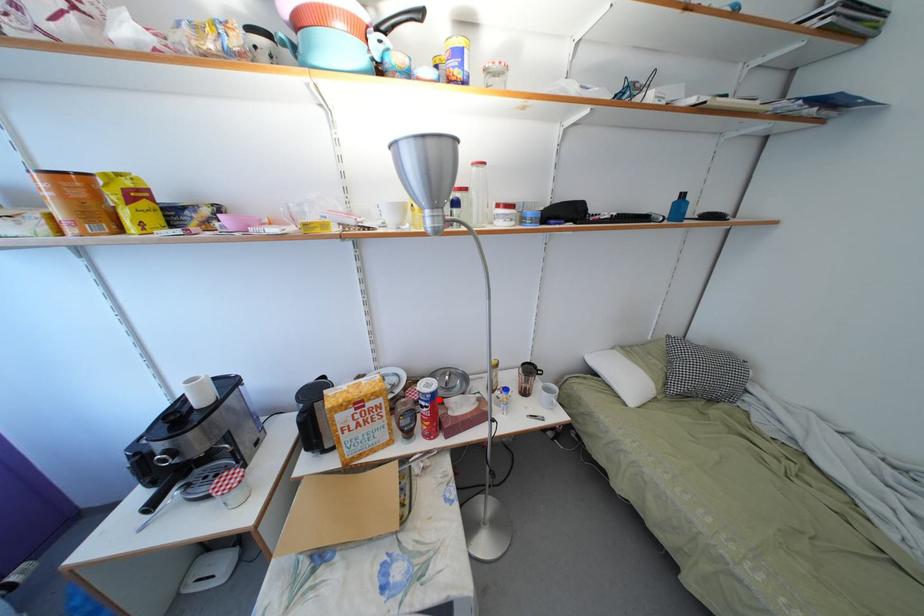
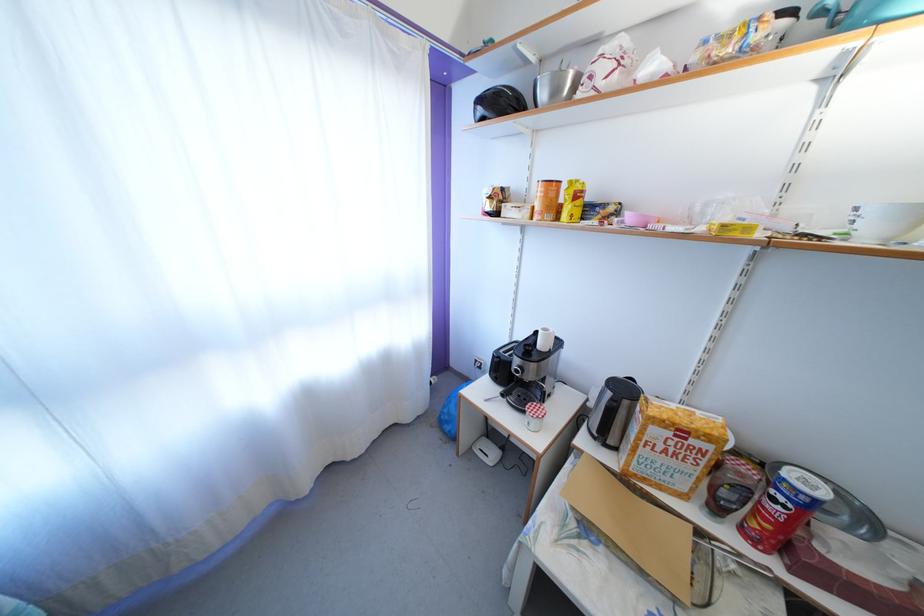
In the second image, find the point that corresponds to the highlighted location in the first image.

(821, 508)